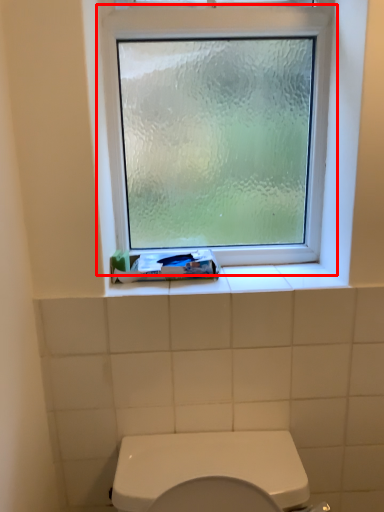
Question: From the image's perspective, what is the correct spatial positioning of window (annotated by the red box) in reference to toothpaste?

Choices:
 (A) below
 (B) above

Answer: (B)